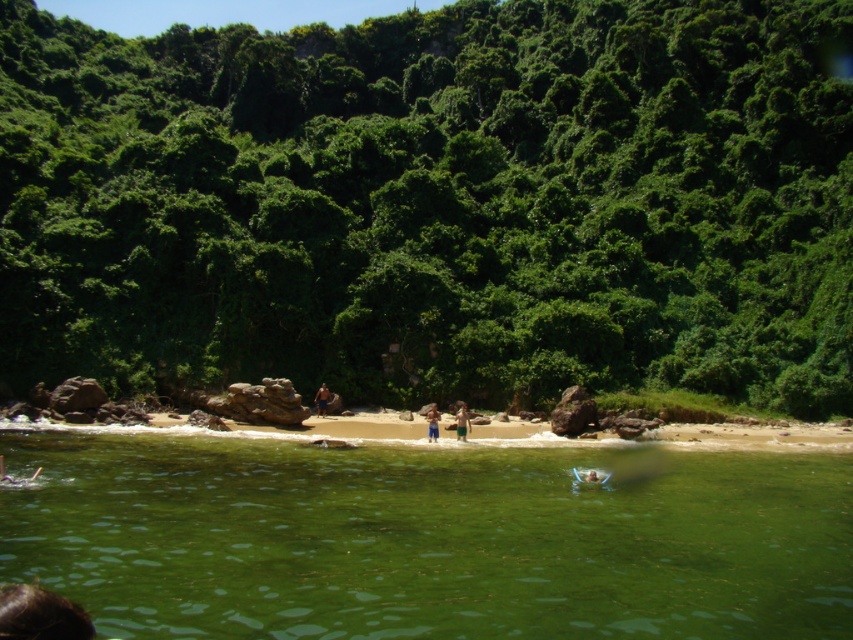
Which is more to the left, green leafy vegetation at center or brown textured shorts at center?

From the viewer's perspective, green leafy vegetation at center appears more on the left side.

Can you confirm if green leafy vegetation at center is shorter than brown textured shorts at center?

In fact, green leafy vegetation at center may be taller than brown textured shorts at center.

Between point (218, 92) and point (322, 406), which one is positioned in front?

Point (322, 406)

At what (x,y) coordinates should I click in order to perform the action: click on green leafy vegetation at center. Please return your answer as a coordinate pair (x, y). This screenshot has width=853, height=640. Looking at the image, I should click on point(434,202).

In the scene shown: Which is below, green shorts at center or brown textured shorts at center?

green shorts at center is lower down.

Who is higher up, green shorts at center or brown textured shorts at center?

Positioned higher is brown textured shorts at center.

Is point (463, 410) in front of point (322, 387)?

Yes.

Where is `green shorts at center`? green shorts at center is located at coordinates (462, 422).

In the scene shown: Is tan skin person at center positioned in front of brown textured shorts at center?

Yes, it is.

Is tan skin person at center bigger than brown textured shorts at center?

Correct, tan skin person at center is larger in size than brown textured shorts at center.

Does point (434, 436) lie behind point (323, 401)?

No, (434, 436) is closer to viewer.

Identify the location of tan skin person at center. (432, 422).